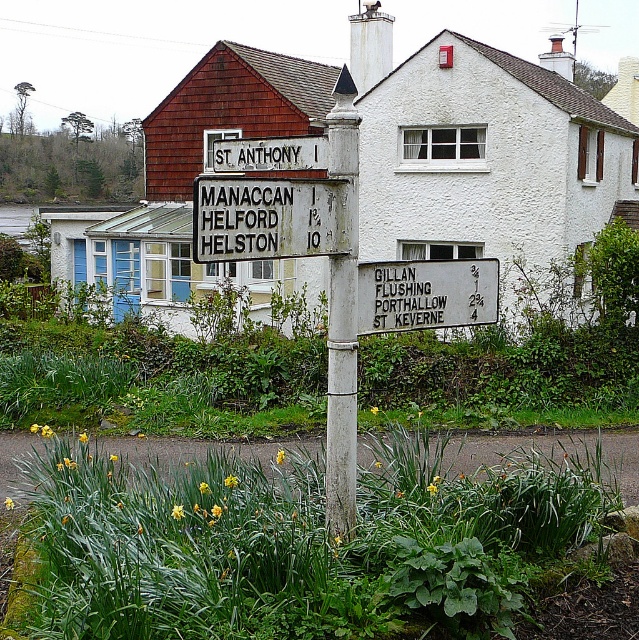
You are standing at the signpost and want to take a photo of both the point at coordinates point (227, 248) and point (335, 84). Which point should you focus on first to ensure both are in the frame?

You should focus on point (227, 248) first because it is closer to you than point (335, 84), ensuring both points are within the camera frame.